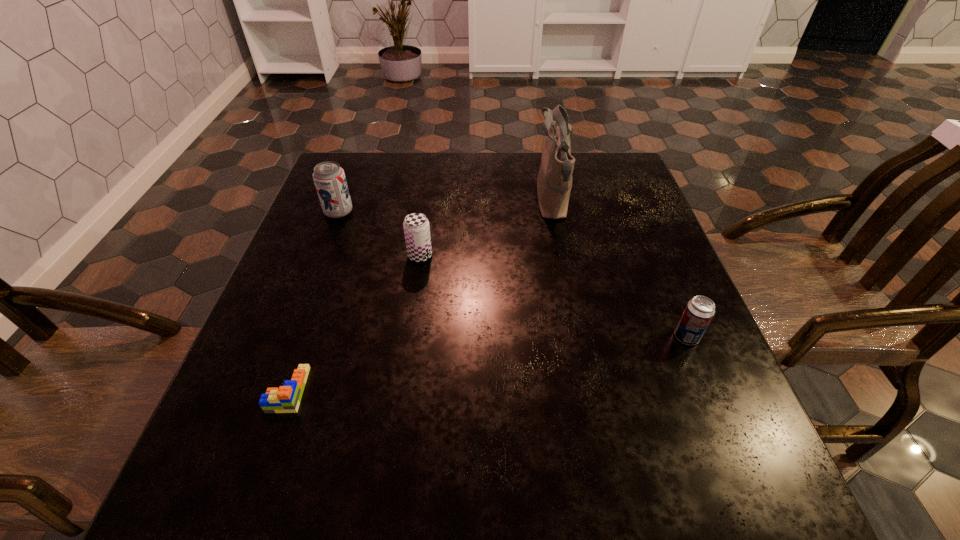
Locate an element on the screen. This screenshot has width=960, height=540. empty space between the second object from right to left and the farthest beer can is located at coordinates (445, 206).

You are a GUI agent. You are given a task and a screenshot of the screen. Output one action in this format:
    pyautogui.click(x=<x>, y=<y>)
    Task: Click on the vacant region between the rightmost beer can and the shortest object
    The image size is (960, 540).
    Given the screenshot: What is the action you would take?
    pyautogui.click(x=488, y=363)

You are a GUI agent. You are given a task and a screenshot of the screen. Output one action in this format:
    pyautogui.click(x=<x>, y=<y>)
    Task: Click on the free area in between the third object from right to left and the Lego
    The image size is (960, 540).
    Given the screenshot: What is the action you would take?
    pyautogui.click(x=354, y=322)

Locate an element on the screen. This screenshot has height=540, width=960. blank region between the leftmost beer can and the Lego is located at coordinates (314, 301).

Image resolution: width=960 pixels, height=540 pixels. What are the coordinates of `free space between the shoulder bag and the Lego` in the screenshot? It's located at (420, 295).

I want to click on vacant region between the shortest object and the third object from right to left, so click(x=354, y=322).

Locate an element on the screen. The height and width of the screenshot is (540, 960). object identified as the third closest to the shoulder bag is located at coordinates (329, 178).

Identify which object is the third nearest to the second object from right to left. Please provide its 2D coordinates. Your answer should be formatted as a tuple, i.e. [(x, y)], where the tuple contains the x and y coordinates of a point satisfying the conditions above.

[(329, 178)]

I want to click on beer can that is the nearest to the shortest object, so click(x=416, y=227).

Select which beer can appears as the second closest to the fourth farthest object. Please provide its 2D coordinates. Your answer should be formatted as a tuple, i.e. [(x, y)], where the tuple contains the x and y coordinates of a point satisfying the conditions above.

[(329, 178)]